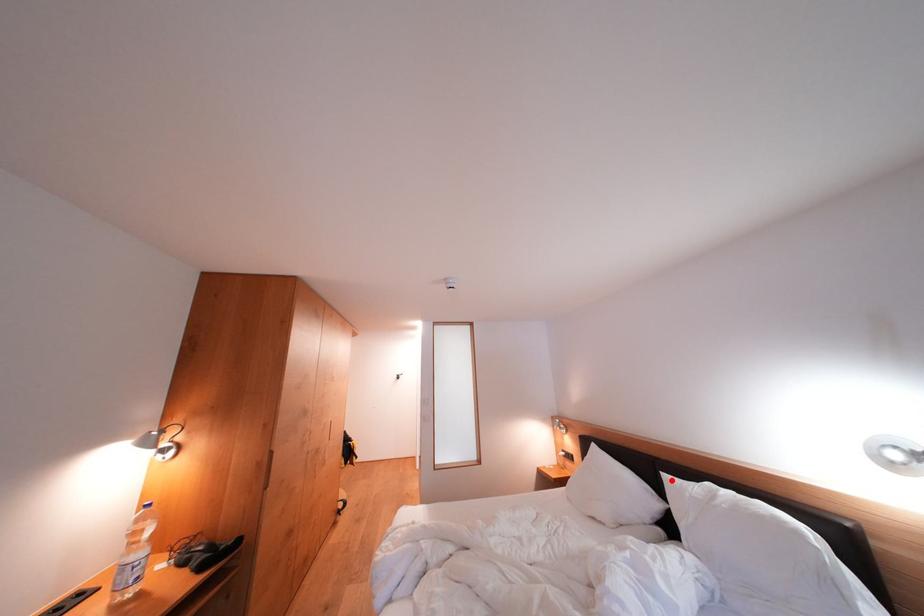
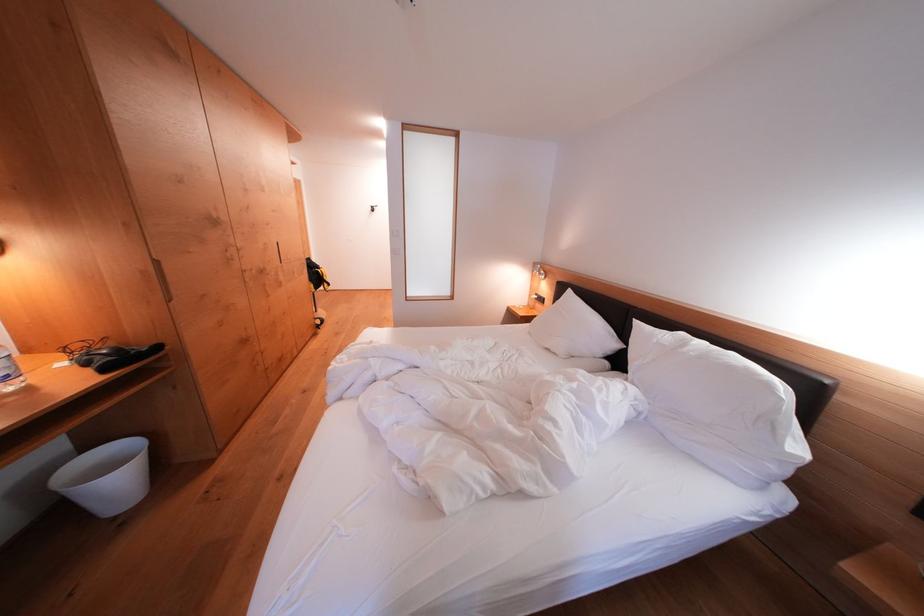
Question: I am providing you with two images of the same scene from different viewpoints. Image1 has a red point marked. In image2, the corresponding 3D location appears at what relative position? Reply with the corresponding letter.

Choices:
 (A) Closer
 (B) Farther

Answer: (A)